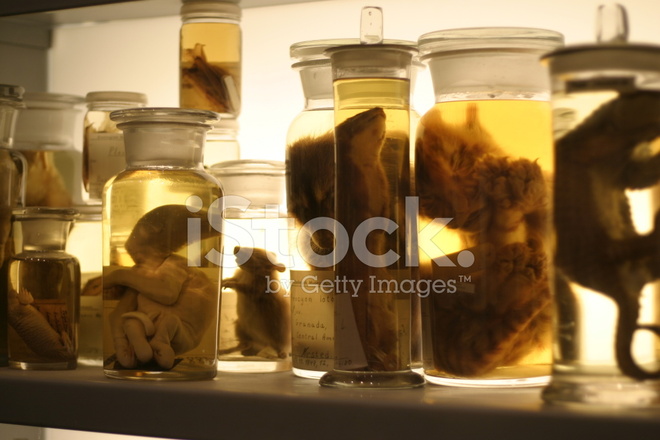
What are the coordinates of `bottles` in the screenshot? It's located at (142, 242).